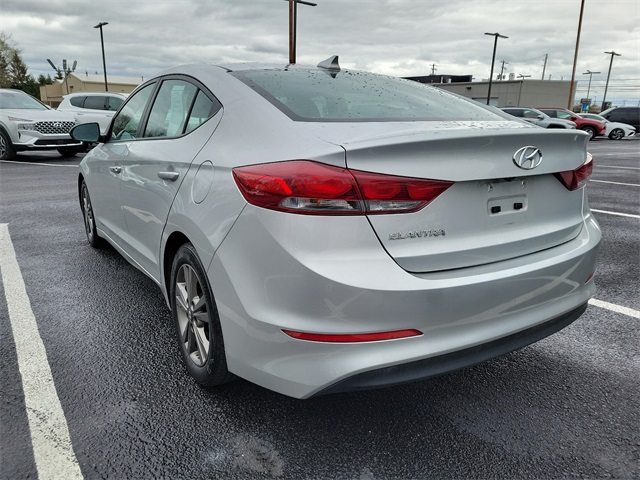
This screenshot has height=480, width=640. Identify the location of back window. (362, 95).